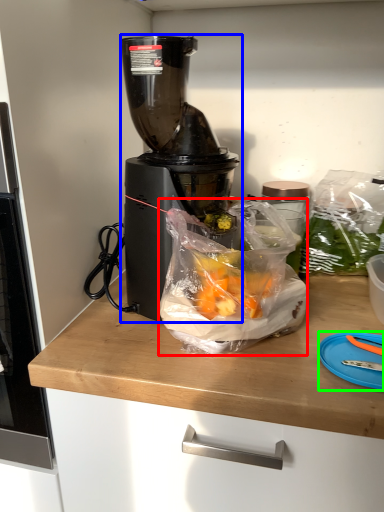
Question: Estimate the real-world distances between objects in this image. Which object is farther from waste (highlighted by a red box), blender (highlighted by a blue box) or cutting board (highlighted by a green box)?

Choices:
 (A) blender
 (B) cutting board

Answer: (B)